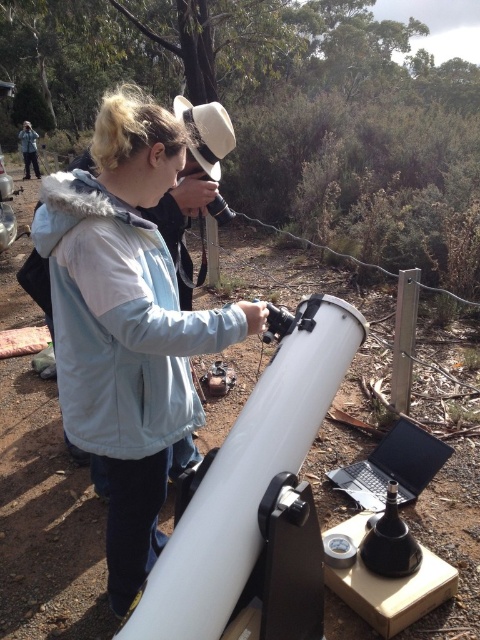
Question: Which object appears farthest from the camera in this image?

Choices:
 (A) black plastic laptop at lower right
 (B) matte black jacket at upper left
 (C) matte white telescope at center

Answer: (B)

Question: Estimate the real-world distances between objects in this image. Which object is farther from the black plastic laptop at lower right?

Choices:
 (A) matte black jacket at upper left
 (B) matte white telescope at center

Answer: (A)

Question: Is black plastic laptop at lower right to the left of matte black jacket at upper left from the viewer's perspective?

Choices:
 (A) no
 (B) yes

Answer: (A)

Question: In this image, where is black plastic laptop at lower right located relative to matte black jacket at upper left?

Choices:
 (A) above
 (B) below

Answer: (B)

Question: Does black plastic laptop at lower right have a smaller size compared to matte black jacket at upper left?

Choices:
 (A) no
 (B) yes

Answer: (B)

Question: Which point appears closest to the camera in this image?

Choices:
 (A) (24, 154)
 (B) (405, 436)
 (C) (145, 525)

Answer: (C)